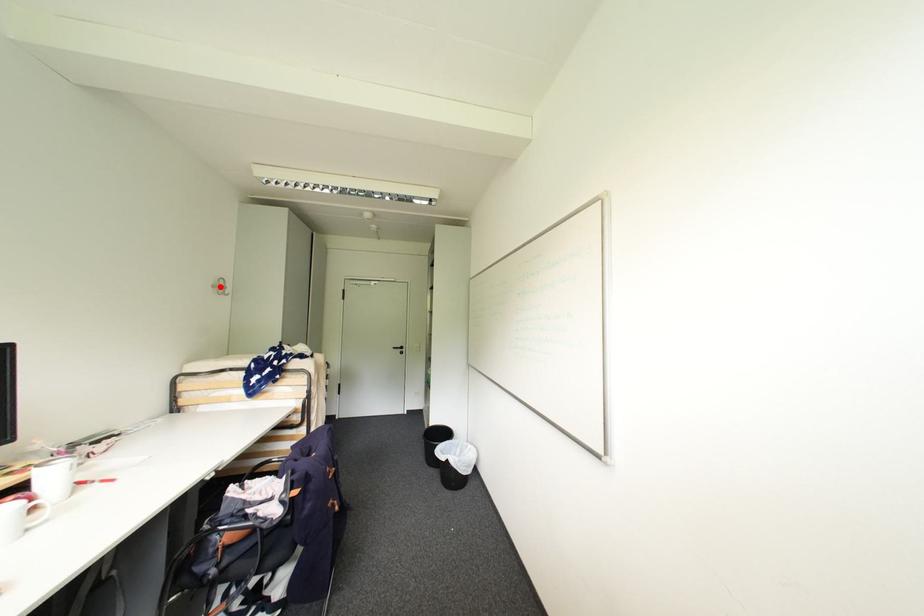
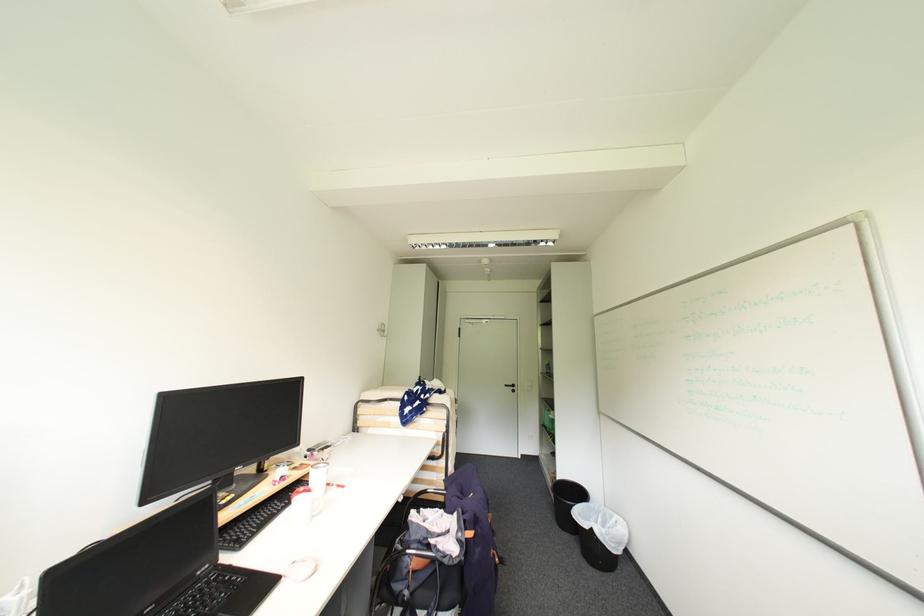
In the second image, find the point that corresponds to the highlighted location in the first image.

(384, 331)